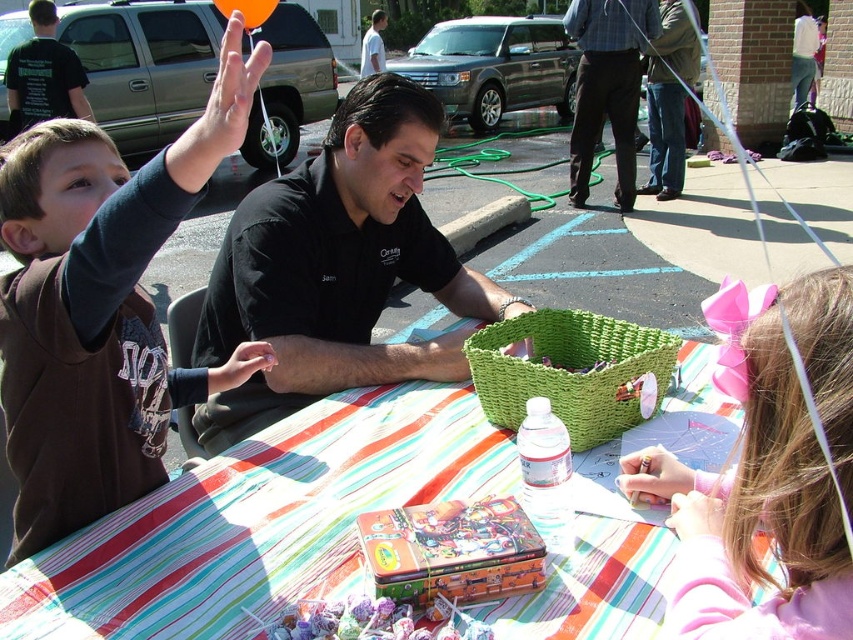
Is point (370, 211) positioned before point (231, 10)?

Yes, it is in front of point (231, 10).

Is point (315, 163) more distant than point (245, 28)?

Yes, it is behind point (245, 28).

Does point (344, 269) come closer to viewer compared to point (244, 20)?

No, it is not.

You are a GUI agent. You are given a task and a screenshot of the screen. Output one action in this format:
    pyautogui.click(x=<x>, y=<y>)
    Task: Click on the black shirt at center
    This screenshot has height=640, width=853.
    Given the screenshot: What is the action you would take?
    pyautogui.click(x=337, y=268)

Does black shirt at center come in front of black shirt at left?

Yes, it is.

Does point (207, 305) come behind point (57, 92)?

No, (207, 305) is in front of (57, 92).

Locate an element on the screen. The image size is (853, 640). black shirt at center is located at coordinates (337, 268).

Does pink fabric hairband at upper right appear over black shirt at left?

No.

Who is positioned more to the left, pink fabric hairband at upper right or black shirt at left?

Answer: From the viewer's perspective, black shirt at left appears more on the left side.

This screenshot has height=640, width=853. What are the coordinates of `pink fabric hairband at upper right` in the screenshot? It's located at (764, 472).